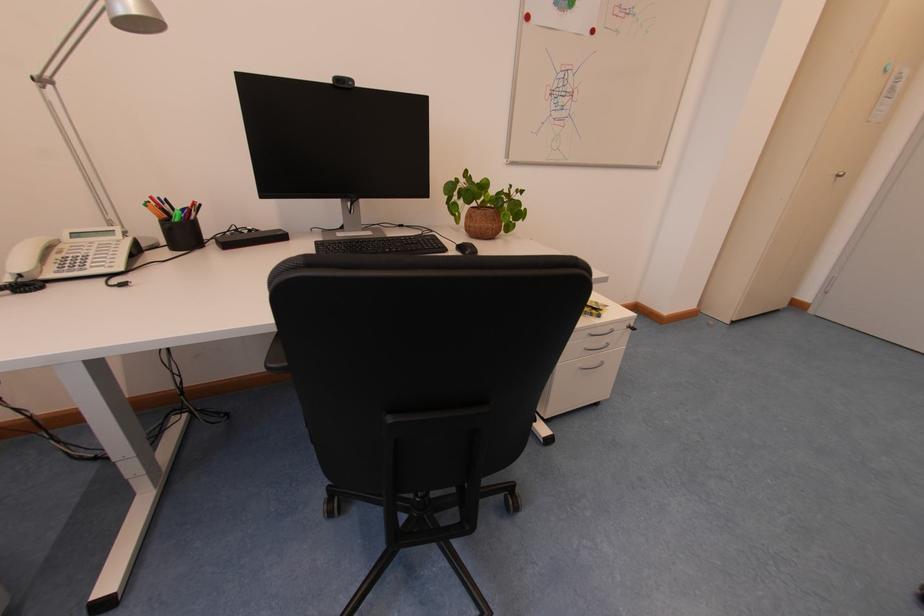
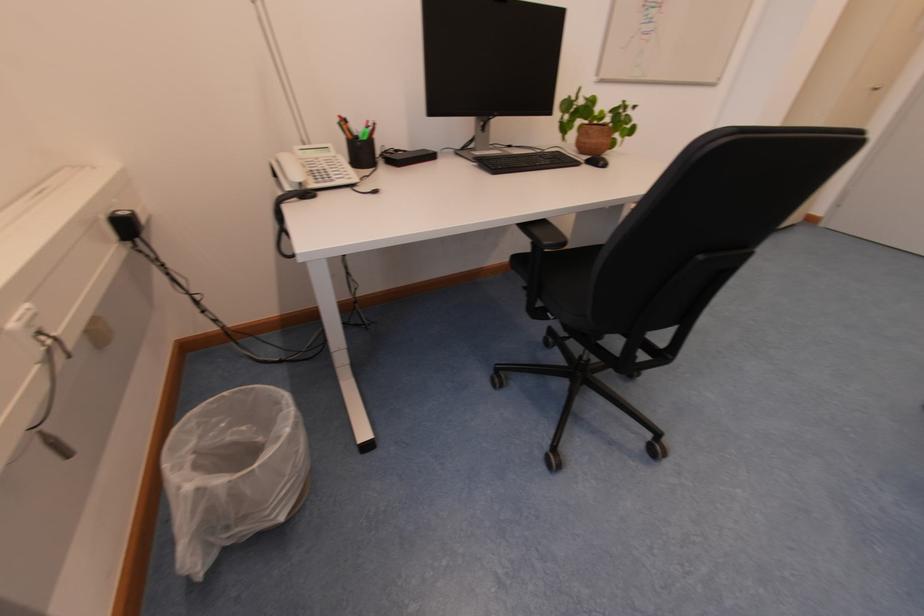
Question: Which direction would the cameraman need to move to produce the second image? Reply with the corresponding letter.

Choices:
 (A) Left
 (B) Right
 (C) Forward
 (D) Backward

Answer: (A)